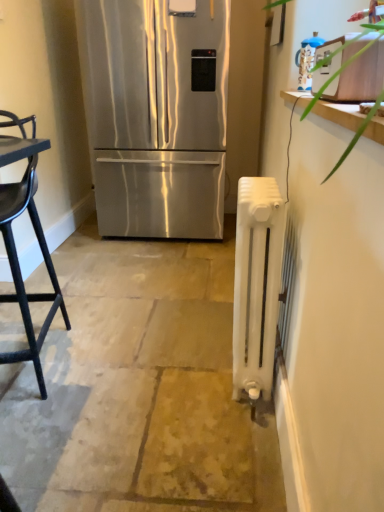
Question: Should I look upward or downward to see stainless steel refrigerator at center?

Choices:
 (A) down
 (B) up

Answer: (B)

Question: Considering the relative positions of black matte chair at left and blue glossy kettle at upper right in the image provided, is black matte chair at left to the right of blue glossy kettle at upper right from the viewer's perspective?

Choices:
 (A) no
 (B) yes

Answer: (A)

Question: Is black matte chair at left directly adjacent to blue glossy kettle at upper right?

Choices:
 (A) no
 (B) yes

Answer: (A)

Question: Is black matte chair at left further to the viewer compared to blue glossy kettle at upper right?

Choices:
 (A) no
 (B) yes

Answer: (A)

Question: Does black matte chair at left have a lesser height compared to blue glossy kettle at upper right?

Choices:
 (A) no
 (B) yes

Answer: (A)

Question: Is blue glossy kettle at upper right located within black matte chair at left?

Choices:
 (A) yes
 (B) no

Answer: (B)

Question: Does black matte chair at left have a larger size compared to blue glossy kettle at upper right?

Choices:
 (A) no
 (B) yes

Answer: (B)

Question: Can you confirm if black matte chair at left is positioned to the right of stainless steel refrigerator at center?

Choices:
 (A) yes
 (B) no

Answer: (B)

Question: Can you confirm if black matte chair at left is smaller than stainless steel refrigerator at center?

Choices:
 (A) no
 (B) yes

Answer: (B)

Question: From a real-world perspective, does black matte chair at left stand above stainless steel refrigerator at center?

Choices:
 (A) yes
 (B) no

Answer: (B)

Question: From the image's perspective, is black matte chair at left under stainless steel refrigerator at center?

Choices:
 (A) no
 (B) yes

Answer: (B)

Question: Is the depth of black matte chair at left greater than that of stainless steel refrigerator at center?

Choices:
 (A) no
 (B) yes

Answer: (A)

Question: Is stainless steel refrigerator at center located within black matte chair at left?

Choices:
 (A) yes
 (B) no

Answer: (B)

Question: Is white painted radiator at right taller than blue glossy kettle at upper right?

Choices:
 (A) yes
 (B) no

Answer: (B)